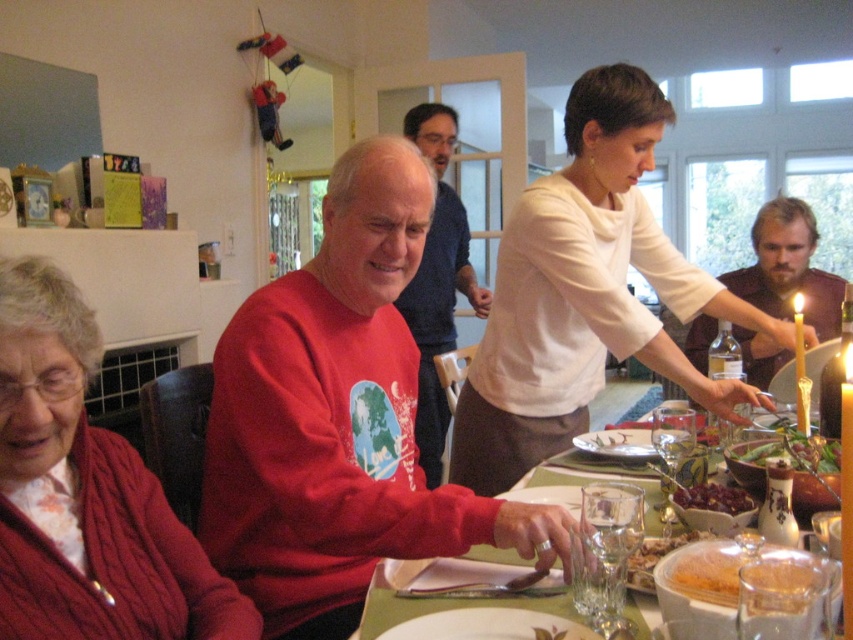
Between brown leather jacket at upper right and white wax candle at upper right, which one is positioned higher?

Positioned higher is brown leather jacket at upper right.

This screenshot has width=853, height=640. I want to click on brown leather jacket at upper right, so click(788, 268).

At what (x,y) coordinates should I click in order to perform the action: click on brown leather jacket at upper right. Please return your answer as a coordinate pair (x, y). The width and height of the screenshot is (853, 640). Looking at the image, I should click on (788, 268).

Who is positioned more to the left, translucent glass at lower right or shiny red grapes at table center?

translucent glass at lower right

Who is more distant from viewer, (648, 576) or (691, 502)?

The point (691, 502) is behind.

The image size is (853, 640). Identify the location of translucent glass at lower right. (656, 557).

Which is more to the right, white matte shirt at center or clear glass water at center?

Positioned to the right is white matte shirt at center.

Can you confirm if white matte shirt at center is taller than clear glass water at center?

Indeed, white matte shirt at center has a greater height compared to clear glass water at center.

Between point (508, 376) and point (543, 472), which one is positioned in front?

Point (543, 472) is more forward.

You are a GUI agent. You are given a task and a screenshot of the screen. Output one action in this format:
    pyautogui.click(x=<x>, y=<y>)
    Task: Click on the white matte shirt at center
    Image resolution: width=853 pixels, height=640 pixels.
    Given the screenshot: What is the action you would take?
    pyautogui.click(x=585, y=292)